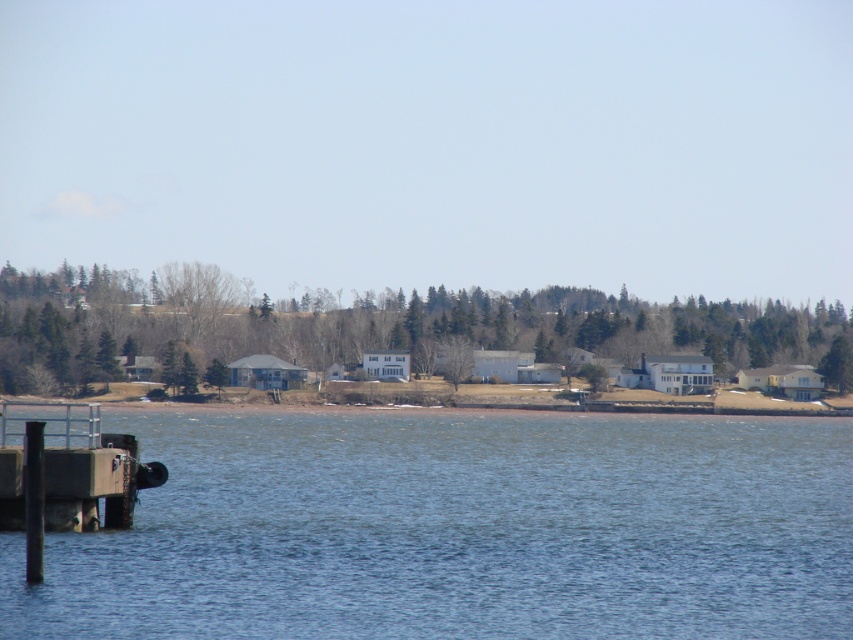
Question: Is blue water at lower left thinner than concrete dock at lower left?

Choices:
 (A) yes
 (B) no

Answer: (B)

Question: Which object is farther from the camera taking this photo?

Choices:
 (A) concrete dock at lower left
 (B) blue water at lower left

Answer: (A)

Question: Among these objects, which one is farthest from the camera?

Choices:
 (A) concrete dock at lower left
 (B) blue water at lower left

Answer: (A)

Question: Is blue water at lower left to the right of concrete dock at lower left from the viewer's perspective?

Choices:
 (A) no
 (B) yes

Answer: (B)

Question: Can you confirm if blue water at lower left is smaller than concrete dock at lower left?

Choices:
 (A) no
 (B) yes

Answer: (A)